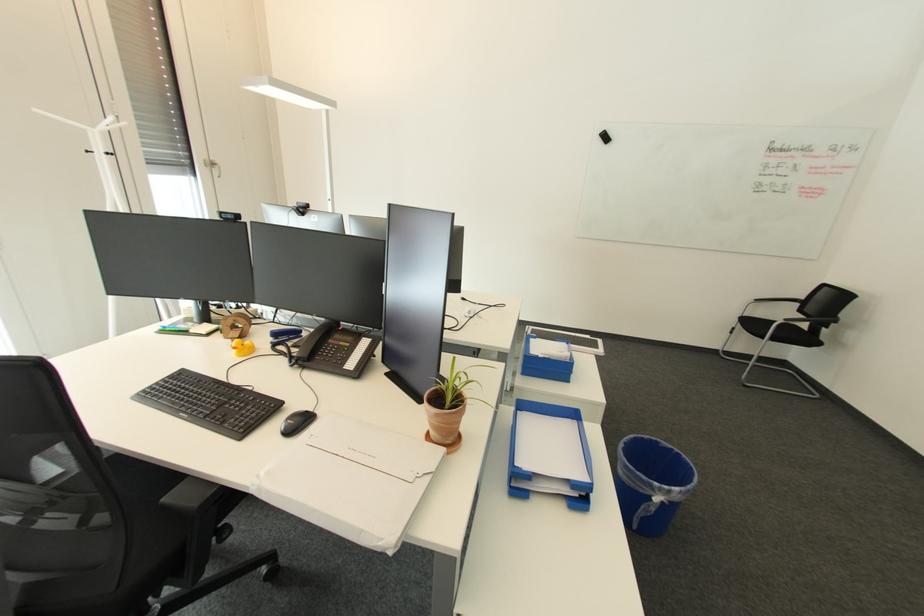
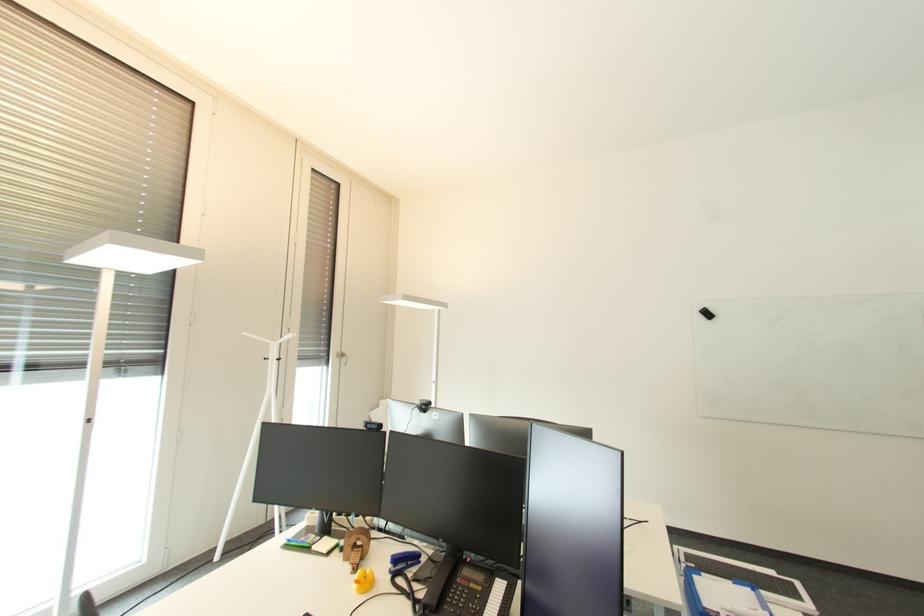
Question: The first image is from the beginning of the video and the second image is from the end. How did the camera likely rotate when shooting the video?

Choices:
 (A) Left
 (B) Right
 (C) Up
 (D) Down

Answer: (C)